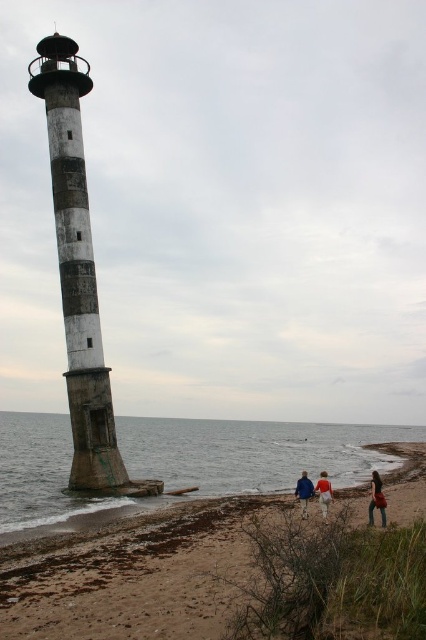
In the scene shown: Does brown sand at lower right have a larger size compared to concrete lighthouse at left?

Yes, brown sand at lower right is bigger than concrete lighthouse at left.

Can you confirm if brown sand at lower right is positioned to the right of concrete lighthouse at left?

Correct, you'll find brown sand at lower right to the right of concrete lighthouse at left.

Is point (146, 628) closer to camera compared to point (65, 68)?

Yes.

You are a GUI agent. You are given a task and a screenshot of the screen. Output one action in this format:
    pyautogui.click(x=<x>, y=<y>)
    Task: Click on the brown sand at lower right
    
    Given the screenshot: What is the action you would take?
    pyautogui.click(x=132, y=573)

Is point (149, 445) more distant than point (319, 499)?

Yes, it is behind point (319, 499).

Is clear water at lower left positioned in front of tan fabric jacket at lower center?

Yes, clear water at lower left is in front of tan fabric jacket at lower center.

Is point (11, 445) closer to camera compared to point (319, 480)?

No, it is behind (319, 480).

The image size is (426, 640). Find the location of `clear water at lower left`. clear water at lower left is located at coordinates (253, 452).

Does concrete lighthouse at left appear on the right side of denim jacket at lower right?

Incorrect, concrete lighthouse at left is not on the right side of denim jacket at lower right.

Can you confirm if concrete lighthouse at left is positioned below denim jacket at lower right?

Actually, concrete lighthouse at left is above denim jacket at lower right.

Find the location of a particular element. concrete lighthouse at left is located at coordinates (77, 269).